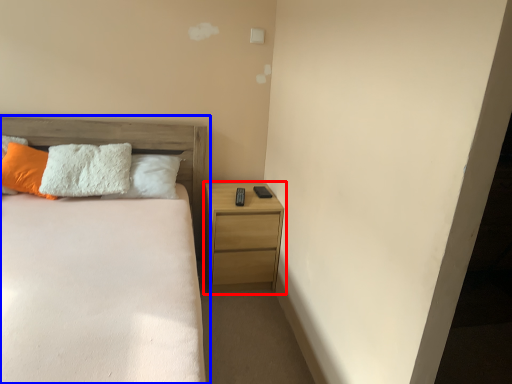
Question: Which object is closer to the camera taking this photo, nightstand (highlighted by a red box) or bed (highlighted by a blue box)?

Choices:
 (A) nightstand
 (B) bed

Answer: (B)